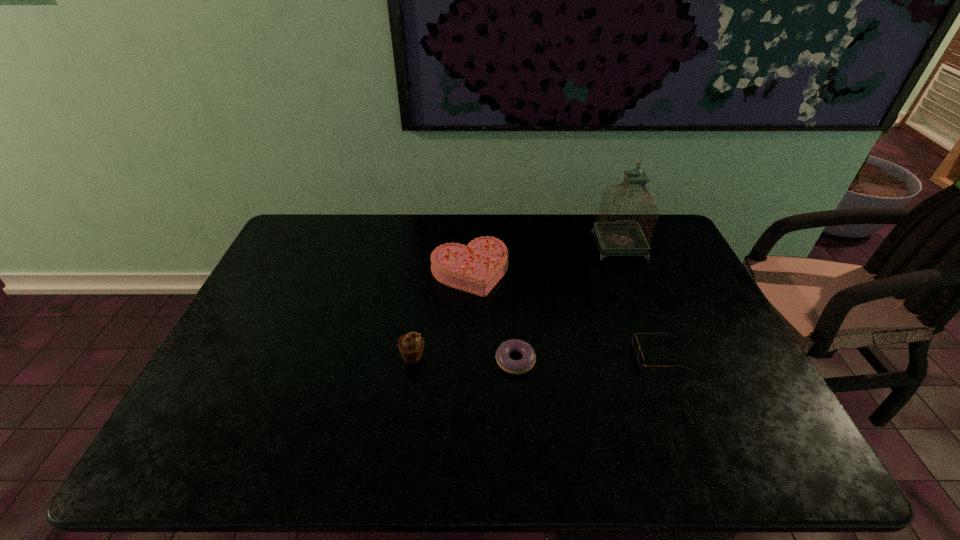
In order to click on vacant area at the far left corner of the desktop in this screenshot , I will do `click(303, 245)`.

The image size is (960, 540). In order to click on vacant space at the near right corner of the desktop in this screenshot , I will do `click(768, 455)`.

The image size is (960, 540). What are the coordinates of `empty space between the doughnut and the birdcage` in the screenshot? It's located at (567, 303).

Find the location of a particular element. unoccupied area between the tallest object and the doughnut is located at coordinates (567, 303).

The image size is (960, 540). In order to click on vacant point located between the doughnut and the birdcage in this screenshot , I will do `click(567, 303)`.

This screenshot has width=960, height=540. What are the coordinates of `vacant space that is in between the sunglasses and the muffin` in the screenshot? It's located at (537, 355).

This screenshot has width=960, height=540. In order to click on free area in between the third shortest object and the tallest object in this screenshot , I will do `click(544, 259)`.

The width and height of the screenshot is (960, 540). Find the location of `vacant space that is in between the sunglasses and the muffin`. vacant space that is in between the sunglasses and the muffin is located at coordinates (537, 355).

Where is `vacant region between the fourth shortest object and the doughnut`? The height and width of the screenshot is (540, 960). vacant region between the fourth shortest object and the doughnut is located at coordinates (465, 359).

In order to click on vacant space that's between the tallest object and the sunglasses in this screenshot , I will do `click(639, 300)`.